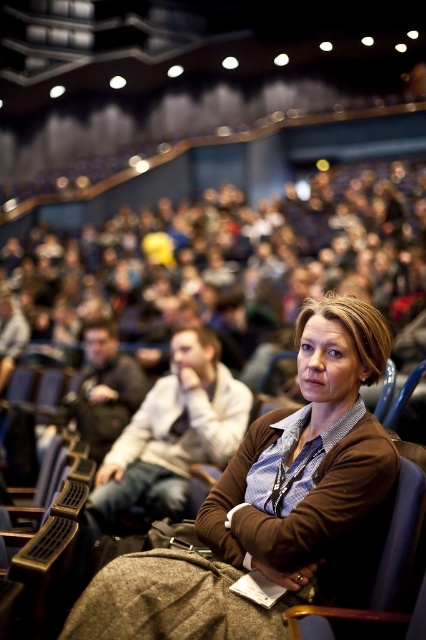
Is point (307, 513) in front of point (351, 609)?

No, (307, 513) is further to viewer.

Does brown fabric jacket at center have a smaller size compared to blue fabric chair at center?

No.

Between point (239, 556) and point (405, 614), which one is positioned behind?

The point (239, 556) is behind.

This screenshot has width=426, height=640. Find the location of `brown fabric jacket at center`. brown fabric jacket at center is located at coordinates (271, 504).